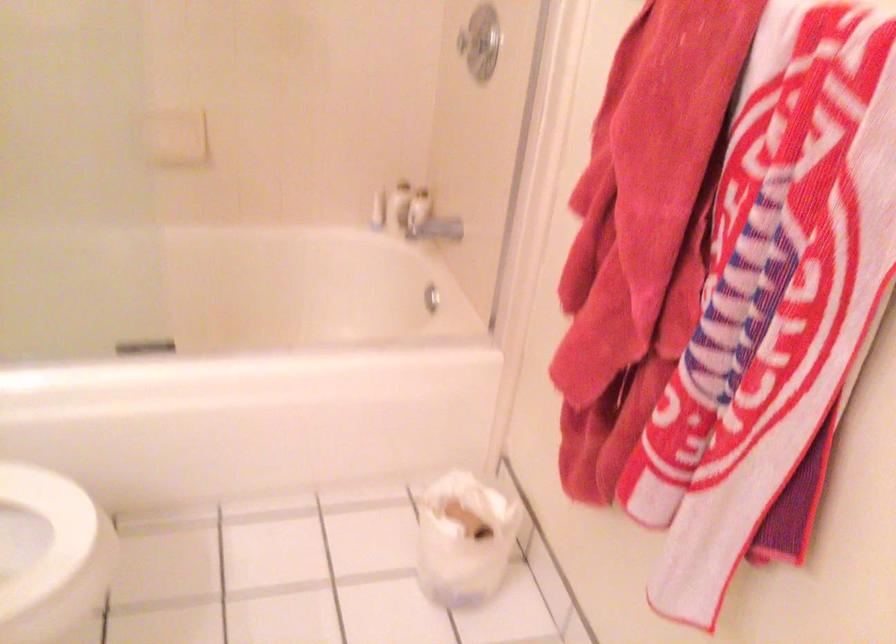
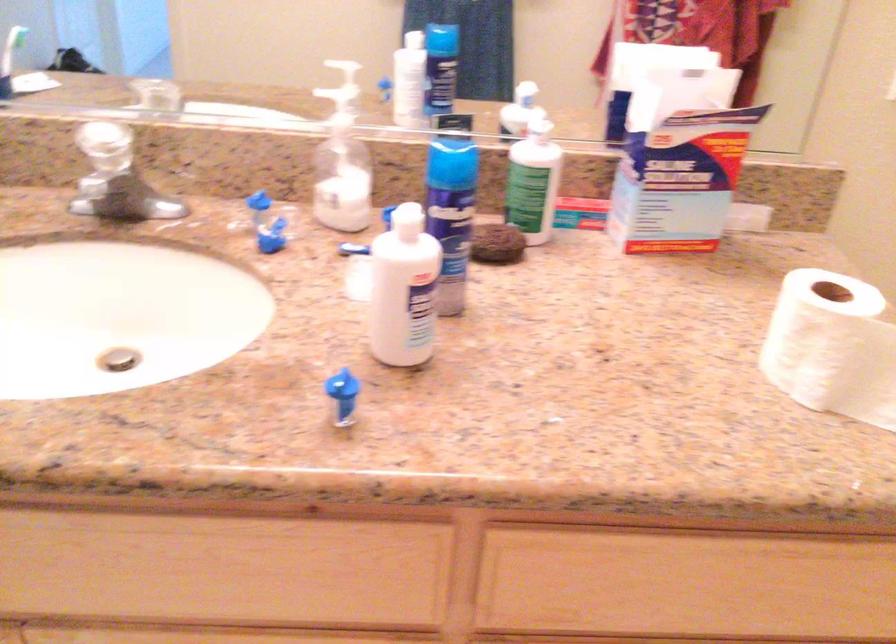
First-person continuous shooting, in which direction is the camera rotating?

The camera's rotation is toward left-down.